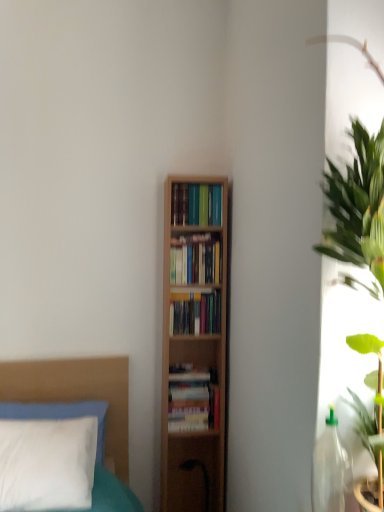
The width and height of the screenshot is (384, 512). In order to click on white soft pillow at lower left in this screenshot , I will do `click(83, 400)`.

What do you see at coordinates (196, 204) in the screenshot? This screenshot has width=384, height=512. I see `hardcover books at center, which is the 1th book in top-to-bottom order` at bounding box center [196, 204].

You are a GUI agent. You are given a task and a screenshot of the screen. Output one action in this format:
    pyautogui.click(x=<x>, y=<y>)
    Task: Click on the wooden bookshelf at center, marked as the 3th book in a bottom-to-top arrangement
    This screenshot has height=512, width=384.
    Given the screenshot: What is the action you would take?
    pyautogui.click(x=196, y=261)

Image resolution: width=384 pixels, height=512 pixels. I want to click on white soft pillow at lower left, so click(83, 400).

Looking at their sizes, would you say hardcover books at center, the first book positioned from the bottom, is wider or thinner than hardcover books at center, acting as the 4th book starting from the bottom?

Clearly, hardcover books at center, the first book positioned from the bottom, has more width compared to hardcover books at center, acting as the 4th book starting from the bottom.

Is hardcover books at center, which is the 4th book from top to bottom, taller or shorter than hardcover books at center, which is the 1th book in top-to-bottom order?

Clearly, hardcover books at center, which is the 4th book from top to bottom, is taller compared to hardcover books at center, which is the 1th book in top-to-bottom order.

Considering the positions of objects hardcover books at center, the first book positioned from the bottom, and hardcover books at center, acting as the 4th book starting from the bottom, in the image provided, who is more to the right, hardcover books at center, the first book positioned from the bottom, or hardcover books at center, acting as the 4th book starting from the bottom,?

hardcover books at center, acting as the 4th book starting from the bottom.

Consider the image. Measure the distance from hardcover books at center, which is the 4th book from top to bottom, to hardcover books at center, acting as the 4th book starting from the bottom.

34.70 inches.

Consider the image. Considering the relative sizes of hardcover books at center, acting as the 4th book starting from the bottom, and wooden bookshelf at center, marked as the 3th book in a bottom-to-top arrangement, in the image provided, is hardcover books at center, acting as the 4th book starting from the bottom, taller than wooden bookshelf at center, marked as the 3th book in a bottom-to-top arrangement,?

No, hardcover books at center, acting as the 4th book starting from the bottom, is not taller than wooden bookshelf at center, marked as the 3th book in a bottom-to-top arrangement.

From the image's perspective, is hardcover books at center, acting as the 4th book starting from the bottom, located above or below wooden bookshelf at center, marked as the 3th book in a bottom-to-top arrangement?

Clearly, from the image's perspective, hardcover books at center, acting as the 4th book starting from the bottom, is above wooden bookshelf at center, marked as the 3th book in a bottom-to-top arrangement.

Which object is positioned more to the left, hardcover books at center, which is the 1th book in top-to-bottom order, or wooden bookshelf at center, marked as the 3th book in a bottom-to-top arrangement?

wooden bookshelf at center, marked as the 3th book in a bottom-to-top arrangement, is more to the left.

Would you say hardcover books at center, acting as the 4th book starting from the bottom, is a long distance from wooden bookshelf at center, marked as the 3th book in a bottom-to-top arrangement?

No, hardcover books at center, acting as the 4th book starting from the bottom, is not far from wooden bookshelf at center, marked as the 3th book in a bottom-to-top arrangement.

Based on their positions, is hardcover books at center, which is the 4th book from top to bottom, located to the left or right of wooden bookshelf at center, marked as the 3th book in a bottom-to-top arrangement?

Based on their positions, hardcover books at center, which is the 4th book from top to bottom, is located to the left of wooden bookshelf at center, marked as the 3th book in a bottom-to-top arrangement.

Could wooden bookshelf at center, marked as the 3th book in a bottom-to-top arrangement, be considered to be inside hardcover books at center, the first book positioned from the bottom?

No.

Which is behind, hardcover books at center, the first book positioned from the bottom, or wooden bookshelf at center, marked as the 3th book in a bottom-to-top arrangement?

hardcover books at center, the first book positioned from the bottom, is more distant.

Identify the location of book that is the 2nd one when counting upward from the hardcover books at center, the first book positioned from the bottom (from the image's perspective). Image resolution: width=384 pixels, height=512 pixels. (196, 261).

From a real-world perspective, is wooden bookshelf at center, marked as the 3th book in a bottom-to-top arrangement, located beneath hardcover books at center, acting as the 4th book starting from the bottom?

Yes, from a real-world perspective, wooden bookshelf at center, marked as the 3th book in a bottom-to-top arrangement, is below hardcover books at center, acting as the 4th book starting from the bottom.

Does wooden bookshelf at center, marked as the 3th book in a bottom-to-top arrangement, touch hardcover books at center, acting as the 4th book starting from the bottom?

They are not placed beside each other.

Considering the relative sizes of wooden bookshelf at center, marked as the 3th book in a bottom-to-top arrangement, and hardcover books at center, which is the 1th book in top-to-bottom order, in the image provided, is wooden bookshelf at center, marked as the 3th book in a bottom-to-top arrangement, smaller than hardcover books at center, which is the 1th book in top-to-bottom order,?

Yes, wooden bookshelf at center, marked as the 3th book in a bottom-to-top arrangement, is smaller than hardcover books at center, which is the 1th book in top-to-bottom order.

From a real-world perspective, count 1st books downward from the hardcover books at center, which is the 1th book in top-to-bottom order, and point to it. Please provide its 2D coordinates.

[(196, 261)]

From the image's perspective, which is above, white soft pillow at lower left or wooden bookshelf at center, marked as the 3th book in a bottom-to-top arrangement?

wooden bookshelf at center, marked as the 3th book in a bottom-to-top arrangement.

Which is behind, white soft pillow at lower left or wooden bookshelf at center, marked as the second book in a top-to-bottom arrangement?

wooden bookshelf at center, marked as the second book in a top-to-bottom arrangement.

From a real-world perspective, is wooden bookshelf at center, marked as the 3th book in a bottom-to-top arrangement, positioned under hardcover books at center, the 3th book when ordered from top to bottom, based on gravity?

No, from a real-world perspective, wooden bookshelf at center, marked as the 3th book in a bottom-to-top arrangement, is not beneath hardcover books at center, the 3th book when ordered from top to bottom.

Considering the sizes of objects wooden bookshelf at center, marked as the 3th book in a bottom-to-top arrangement, and hardcover books at center, which appears as the 2th book when ordered from the bottom, in the image provided, who is shorter, wooden bookshelf at center, marked as the 3th book in a bottom-to-top arrangement, or hardcover books at center, which appears as the 2th book when ordered from the bottom,?

hardcover books at center, which appears as the 2th book when ordered from the bottom.

Is wooden bookshelf at center, marked as the 3th book in a bottom-to-top arrangement, not within hardcover books at center, which appears as the 2th book when ordered from the bottom?

Indeed, wooden bookshelf at center, marked as the 3th book in a bottom-to-top arrangement, is completely outside hardcover books at center, which appears as the 2th book when ordered from the bottom.

Between wooden bookshelf at center, marked as the second book in a top-to-bottom arrangement, and hardcover books at center, the 3th book when ordered from top to bottom, which one is positioned behind?

Positioned behind is hardcover books at center, the 3th book when ordered from top to bottom.

Is white soft pillow at lower left at the left side of hardcover books at center, the 3th book when ordered from top to bottom?

Indeed, white soft pillow at lower left is positioned on the left side of hardcover books at center, the 3th book when ordered from top to bottom.

Is white soft pillow at lower left oriented away from hardcover books at center, which appears as the 2th book when ordered from the bottom?

No, hardcover books at center, which appears as the 2th book when ordered from the bottom, is not at the back of white soft pillow at lower left.

Is white soft pillow at lower left inside the boundaries of hardcover books at center, the 3th book when ordered from top to bottom, or outside?

white soft pillow at lower left cannot be found inside hardcover books at center, the 3th book when ordered from top to bottom.

From a real-world perspective, is white soft pillow at lower left beneath hardcover books at center, which appears as the 2th book when ordered from the bottom?

Correct, in the physical world, white soft pillow at lower left is lower than hardcover books at center, which appears as the 2th book when ordered from the bottom.

Identify the location of the 3rd book behind the hardcover books at center, acting as the 4th book starting from the bottom. Image resolution: width=384 pixels, height=512 pixels. (193, 399).

The height and width of the screenshot is (512, 384). What are the coordinates of `the 1st book located beneath the hardcover books at center, acting as the 4th book starting from the bottom (from a real-world perspective)` in the screenshot? It's located at (196, 261).

When comparing their distances from hardcover books at center, which is the 4th book from top to bottom, does white soft pillow at lower left or hardcover books at center, the 3th book when ordered from top to bottom, seem closer?

Among the two, hardcover books at center, the 3th book when ordered from top to bottom, is located nearer to hardcover books at center, which is the 4th book from top to bottom.

Estimate the real-world distances between objects in this image. Which object is closer to hardcover books at center, which appears as the 2th book when ordered from the bottom, hardcover books at center, the first book positioned from the bottom, or hardcover books at center, acting as the 4th book starting from the bottom?

hardcover books at center, the first book positioned from the bottom.

Based on the photo, from the image, which object appears to be farther from hardcover books at center, acting as the 4th book starting from the bottom, hardcover books at center, which appears as the 2th book when ordered from the bottom, or white soft pillow at lower left?

Among the two, white soft pillow at lower left is located further to hardcover books at center, acting as the 4th book starting from the bottom.

Looking at this image, which object lies nearer to the anchor point hardcover books at center, which is the 4th book from top to bottom, hardcover books at center, which is the 1th book in top-to-bottom order, or wooden bookshelf at center, marked as the 3th book in a bottom-to-top arrangement?

wooden bookshelf at center, marked as the 3th book in a bottom-to-top arrangement, is closer to hardcover books at center, which is the 4th book from top to bottom.

When comparing their distances from hardcover books at center, which appears as the 2th book when ordered from the bottom, does wooden bookshelf at center, marked as the 3th book in a bottom-to-top arrangement, or hardcover books at center, which is the 1th book in top-to-bottom order, seem closer?

The object closer to hardcover books at center, which appears as the 2th book when ordered from the bottom, is wooden bookshelf at center, marked as the 3th book in a bottom-to-top arrangement.

Which object lies nearer to the anchor point hardcover books at center, which appears as the 2th book when ordered from the bottom, hardcover books at center, which is the 1th book in top-to-bottom order, or wooden bookshelf at center, marked as the second book in a top-to-bottom arrangement?

wooden bookshelf at center, marked as the second book in a top-to-bottom arrangement.

Looking at the image, which one is located closer to hardcover books at center, which appears as the 2th book when ordered from the bottom, hardcover books at center, acting as the 4th book starting from the bottom, or white soft pillow at lower left?

hardcover books at center, acting as the 4th book starting from the bottom, lies closer to hardcover books at center, which appears as the 2th book when ordered from the bottom, than the other object.

Considering their positions, is hardcover books at center, which is the 4th book from top to bottom, positioned further to hardcover books at center, the 3th book when ordered from top to bottom, than white soft pillow at lower left?

white soft pillow at lower left.

Where is `book between white soft pillow at lower left and hardcover books at center, the 3th book when ordered from top to bottom, from left to right`? This screenshot has height=512, width=384. book between white soft pillow at lower left and hardcover books at center, the 3th book when ordered from top to bottom, from left to right is located at coordinates (193, 399).

Where is `book between wooden bookshelf at center, marked as the 3th book in a bottom-to-top arrangement, and hardcover books at center, which is the 4th book from top to bottom, vertically`? book between wooden bookshelf at center, marked as the 3th book in a bottom-to-top arrangement, and hardcover books at center, which is the 4th book from top to bottom, vertically is located at coordinates (195, 313).

This screenshot has width=384, height=512. I want to click on book that lies between hardcover books at center, which is the 1th book in top-to-bottom order, and hardcover books at center, which appears as the 2th book when ordered from the bottom, from top to bottom, so click(196, 261).